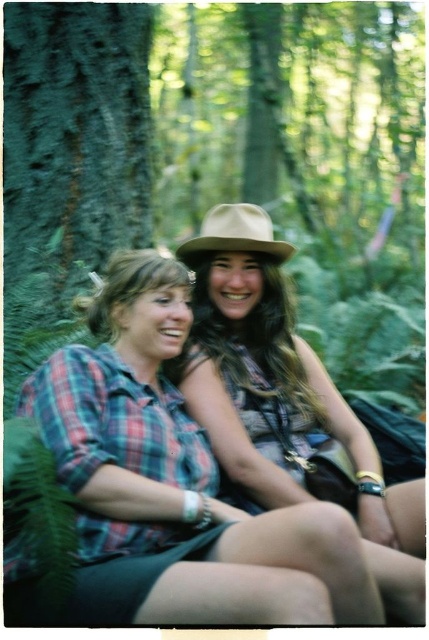
You are standing in a forest and see two points marked in the image. The first point is at coordinate point (x=172, y=456) and the second point is at coordinate point (x=26, y=99). Which point is closer to you?

Point (x=172, y=456) is in front of point (x=26, y=99), so it is closer to you.

You are a photographer trying to capture a clear photo of the brown felt fedora at center. However, the matte brown hat at center is blocking your view. Can you adjust your position to take the photo without moving either hat?

The matte brown hat at center is in front of the brown felt fedora at center, so you can move your position slightly to the side to get a clear view of the brown felt fedora at center without moving either hat.

From the picture: You are a photographer trying to capture a closeup shot of both the plaid fabric shirt at center and the matte brown hat at center. Since your camera can only focus on one object at a time, which object should you focus on to ensure it appears larger in the photo?

The plaid fabric shirt at center has a larger width than the matte brown hat at center, so focusing on the plaid fabric shirt at center will make it appear larger in the photo.